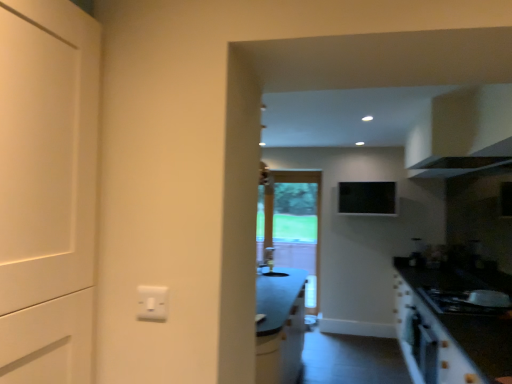
Question: From a real-world perspective, is white glossy cabinet at upper right above or below clear glass screen door at center?

Choices:
 (A) below
 (B) above

Answer: (B)

Question: From the image's perspective, is white glossy cabinet at upper right located above or below clear glass screen door at center?

Choices:
 (A) above
 (B) below

Answer: (A)

Question: Which object is positioned farthest from the white glossy sink at center?

Choices:
 (A) black matte gas stove at lower right
 (B) clear glass screen door at center
 (C) white glossy cabinet at upper right

Answer: (C)

Question: Which object is positioned farthest from the white glossy sink at center?

Choices:
 (A) black matte gas stove at lower right
 (B) white glossy cabinet at upper right
 (C) clear glass screen door at center

Answer: (B)